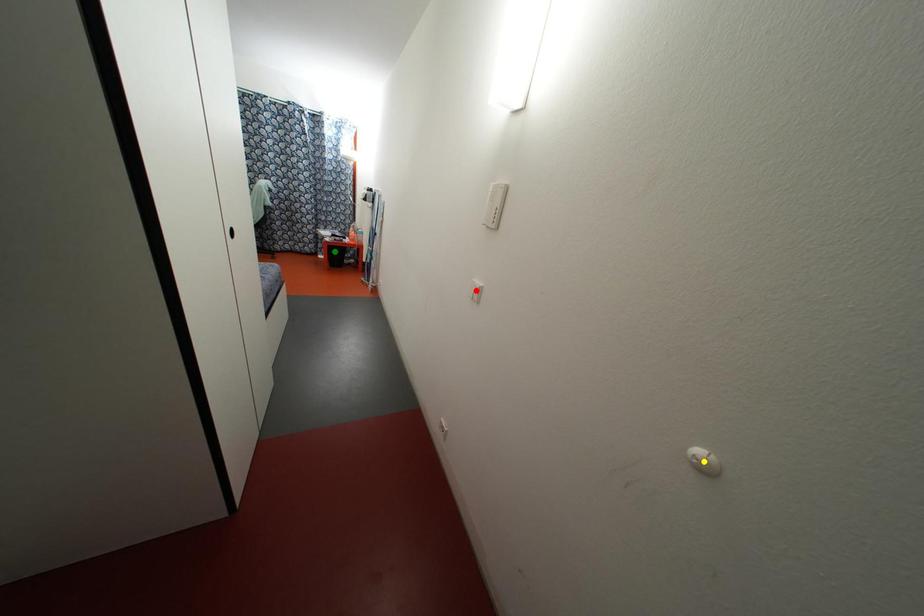
Order these from nearest to farthest:
A) green point
B) yellow point
C) red point

yellow point, red point, green point